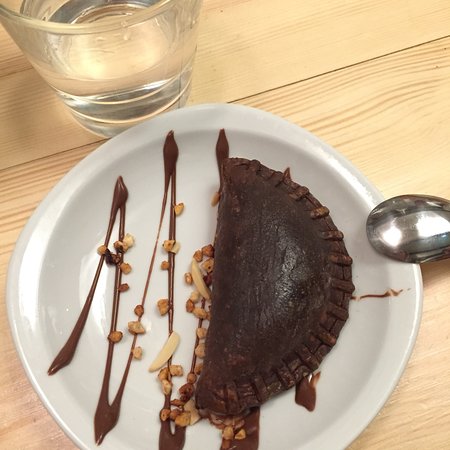
Locate an element on the screen. cup is located at coordinates (151, 82).